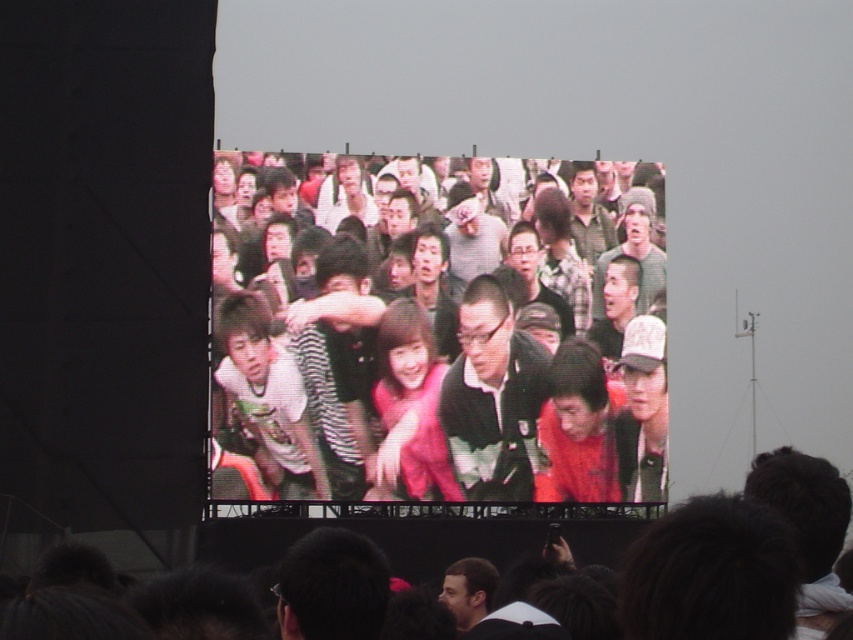
From the picture: Does matte black jacket at center have a lesser height compared to pink fabric crowd at center?

No.

Is point (416, 163) farther from camera compared to point (846, 515)?

Yes, it is.

You are a GUI agent. You are given a task and a screenshot of the screen. Output one action in this format:
    pyautogui.click(x=<x>, y=<y>)
    Task: Click on the matte black jacket at center
    The height and width of the screenshot is (640, 853).
    Given the screenshot: What is the action you would take?
    pyautogui.click(x=457, y=346)